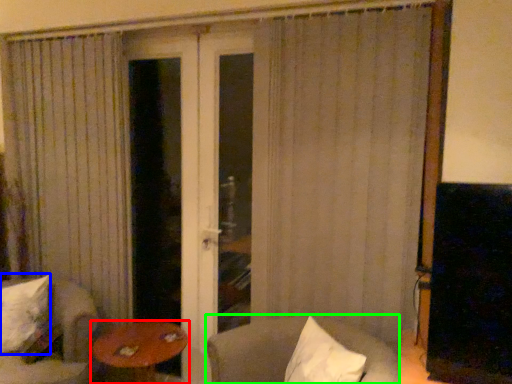
Question: Based on their relative distances, which object is farther from table (highlighted by a red box)? Choose from pillow (highlighted by a blue box) and chair (highlighted by a green box).

Choices:
 (A) pillow
 (B) chair

Answer: (B)